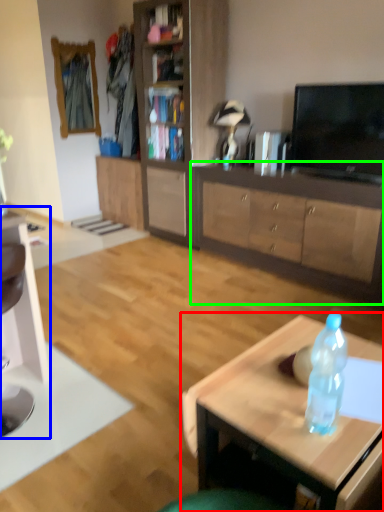
Question: Which object is positioned farthest from coffee table (highlighted by a red box)? Select from computer desk (highlighted by a blue box) and cabinetry (highlighted by a green box).

Choices:
 (A) computer desk
 (B) cabinetry

Answer: (B)